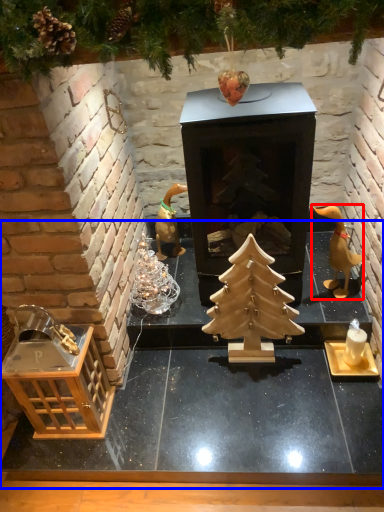
Question: Which object appears closest to the camera in this image, toy (highlighted by a red box) or table (highlighted by a blue box)?

Choices:
 (A) toy
 (B) table

Answer: (B)